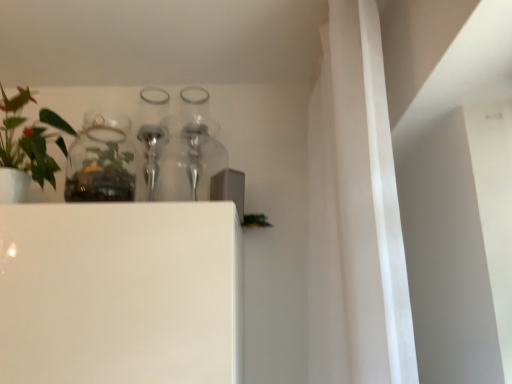
Question: Are clear glass bottle at upper center and clear glass jar at upper left making contact?

Choices:
 (A) yes
 (B) no

Answer: (B)

Question: Is clear glass bottle at upper center far from clear glass jar at upper left?

Choices:
 (A) yes
 (B) no

Answer: (B)

Question: Does clear glass bottle at upper center have a larger size compared to clear glass jar at upper left?

Choices:
 (A) no
 (B) yes

Answer: (A)

Question: From the image's perspective, does clear glass bottle at upper center appear higher than clear glass jar at upper left?

Choices:
 (A) no
 (B) yes

Answer: (B)

Question: Is clear glass bottle at upper center looking in the opposite direction of clear glass jar at upper left?

Choices:
 (A) no
 (B) yes

Answer: (A)

Question: Is clear glass bottle at upper center thinner than clear glass jar at upper left?

Choices:
 (A) no
 (B) yes

Answer: (B)

Question: Is the position of green matte plant at left less distant than that of clear glass bottle at upper center?

Choices:
 (A) yes
 (B) no

Answer: (A)

Question: Does green matte plant at left have a larger size compared to clear glass bottle at upper center?

Choices:
 (A) no
 (B) yes

Answer: (B)

Question: Is clear glass bottle at upper center a part of green matte plant at left?

Choices:
 (A) yes
 (B) no

Answer: (B)

Question: Does green matte plant at left have a lesser height compared to clear glass bottle at upper center?

Choices:
 (A) no
 (B) yes

Answer: (B)

Question: Is green matte plant at left in contact with clear glass bottle at upper center?

Choices:
 (A) no
 (B) yes

Answer: (A)

Question: Considering the relative sizes of green matte plant at left and clear glass bottle at upper center in the image provided, is green matte plant at left thinner than clear glass bottle at upper center?

Choices:
 (A) yes
 (B) no

Answer: (B)

Question: From a real-world perspective, is clear glass jar at upper left on green matte plant at left?

Choices:
 (A) yes
 (B) no

Answer: (B)